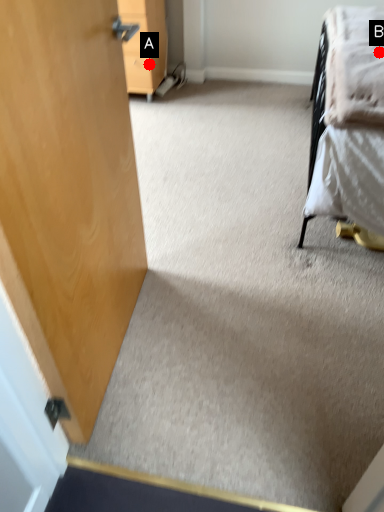
Question: Two points are circled on the image, labeled by A and B beside each circle. Which point is farther to the camera?

Choices:
 (A) A is further
 (B) B is further

Answer: (A)